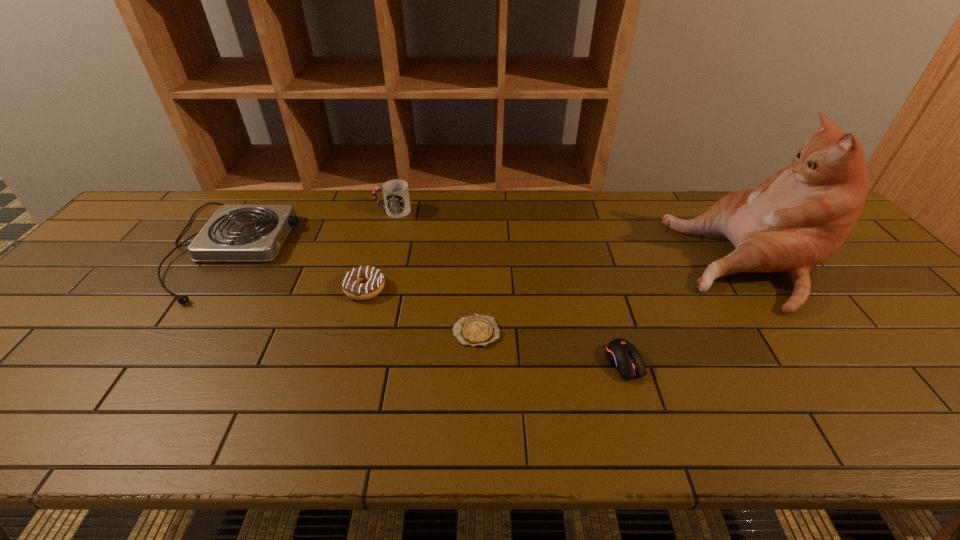
Locate an element on the screen. Image resolution: width=960 pixels, height=540 pixels. the third closest object to the computer mouse is located at coordinates (374, 280).

Find the location of a particular element. free space that satisfies the following two spatial constraints: 1. on the face of the rightmost object; 2. on the front side of the computer mouse is located at coordinates (826, 362).

Image resolution: width=960 pixels, height=540 pixels. Identify the location of vacant space that satisfies the following two spatial constraints: 1. with a retractable cable on the side of the quiche; 2. on the left side of the leftmost object. (172, 332).

What are the coordinates of `free space that satisfies the following two spatial constraints: 1. with a retractable cable on the side of the hotplate; 2. on the back side of the computer mouse` in the screenshot? It's located at (151, 362).

Identify the location of vacant area in the image that satisfies the following two spatial constraints: 1. on the face of the rightmost object; 2. on the front side of the quiche. The image size is (960, 540). coord(804,332).

Locate an element on the screen. vacant space that satisfies the following two spatial constraints: 1. with a retractable cable on the side of the third tallest object; 2. on the right side of the fifth object from left to right is located at coordinates (151, 362).

The width and height of the screenshot is (960, 540). I want to click on free space that satisfies the following two spatial constraints: 1. with a retractable cable on the side of the hotplate; 2. on the right side of the doughnut, so click(x=201, y=289).

Where is `vacant space that satisfies the following two spatial constraints: 1. with a retractable cable on the side of the leftmost object; 2. on the back side of the fifth object from left to right`? This screenshot has height=540, width=960. vacant space that satisfies the following two spatial constraints: 1. with a retractable cable on the side of the leftmost object; 2. on the back side of the fifth object from left to right is located at coordinates (151, 362).